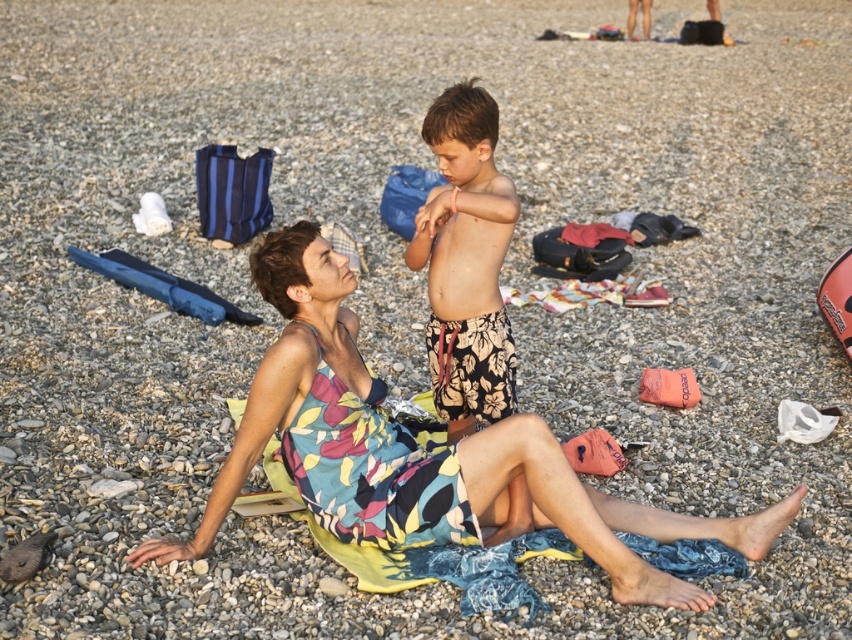
Looking at this image, how much distance is there between floral dress at center and floral swim trunks at center?

A distance of 26.79 inches exists between floral dress at center and floral swim trunks at center.

Measure the distance between point (292, 253) and camera.

13.57 feet

At what (x,y) coordinates should I click in order to perform the action: click on floral dress at center. Please return your answer as a coordinate pair (x, y). Looking at the image, I should click on [x=423, y=452].